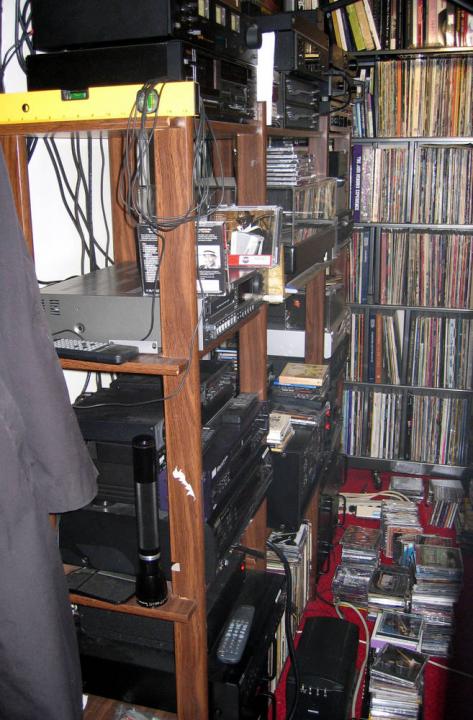
Where is `wooden shelves`? wooden shelves is located at coordinates (100, 711), (178, 608), (149, 361), (99, 125).